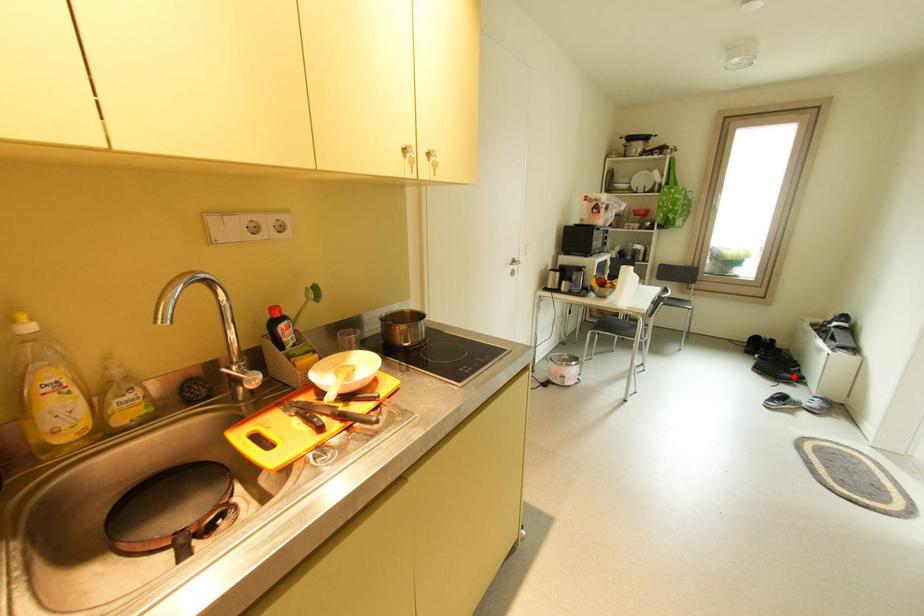
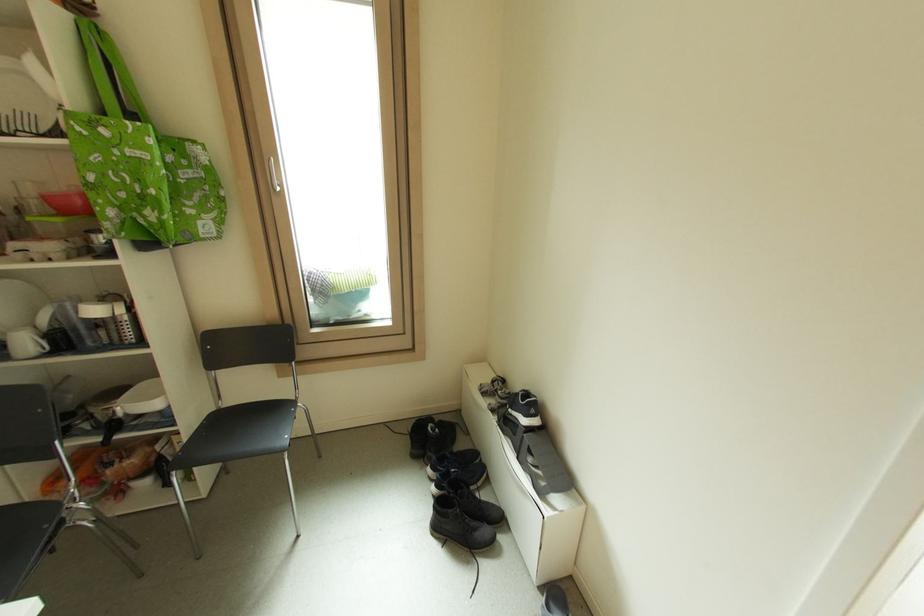
Question: I am providing you with two images of the same scene from different viewpoints. A red point is marked on the first image. At the location where the point appears in image 1, is it still visible in image 2?

Choices:
 (A) Yes
 (B) No

Answer: (A)